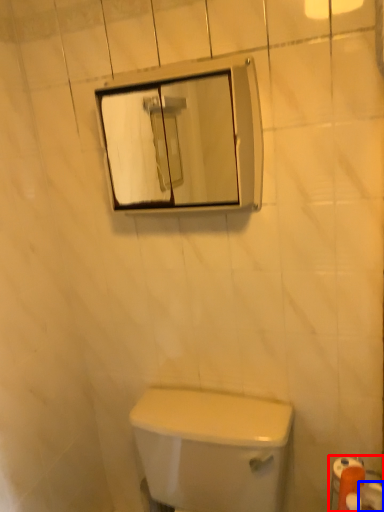
Question: Which point is closer to the camera, toilet paper (highlighted by a red box) or toilet paper (highlighted by a blue box)?

Choices:
 (A) toilet paper
 (B) toilet paper

Answer: (B)